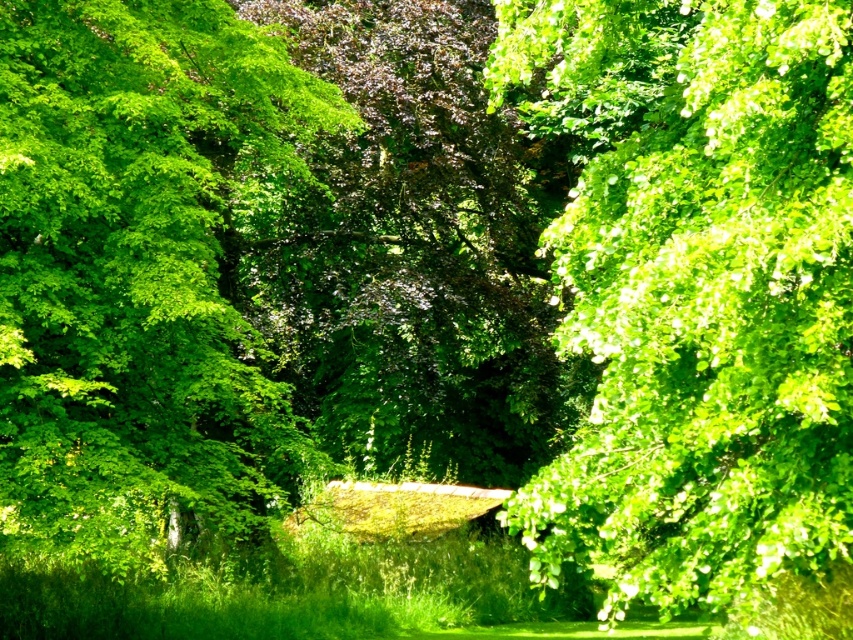
You are a bird seeking shelter. You notice two trees in the scene, the green leafy tree at upper right and the green leafy tree at center. Which tree is taller and would provide better shelter?

The green leafy tree at center is taller than the green leafy tree at upper right, so it would provide better shelter.

Based on the scene description, where is the green leafy tree at upper right located in terms of its 2D coordinates?

The green leafy tree at upper right is located at the 2D coordinates of point (695,288).

From the picture: You are standing in the middle of the forest and see two points marked in the image. The first point is at coordinates point (x=816, y=305) and the second point is at point (x=64, y=20). Which point is closer to you?

Point (x=816, y=305) is in front of point (x=64, y=20), so it is closer to you.